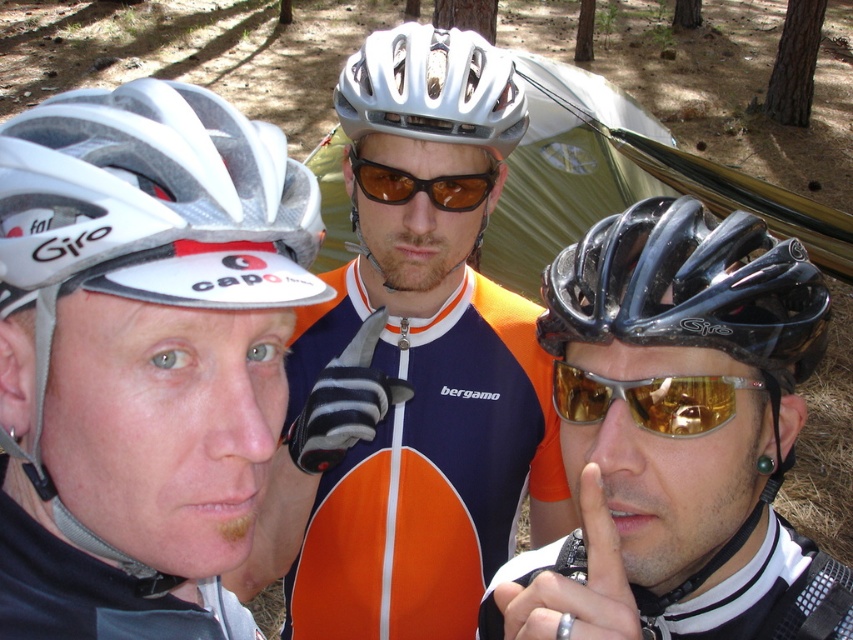
You are standing in the forest scene and want to move from the point closer to you to the point further away. Which path would you take between the two points, point (236,275) and point (553,332)?

You should take the path from point (236,275) to point (553,332) because point (236,275) is closer to the viewer and you need to move to the farther point.

You are a photographer setting up a shot of the matte white helmet at center and the metallic ring at center. You need to frame both objects so that they appear balanced in the composition. Considering their sizes, which object should you place closer to the camera to achieve this balance?

The matte white helmet at center is wider than the metallic ring at center. To balance their sizes in the composition, you should place the metallic ring at center closer to the camera since it is narrower and needs to appear larger in the frame to match the size of the matte white helmet at center.

You are a photographer positioned at the camera. You want to take a photo that includes both the point at (515, 404) and the point at (573, 634). Which point should you focus on first to ensure both are in focus?

You should focus on the point at (515, 404) first because it is closer to the camera than the point at (573, 634). By focusing on the closer point, the farther point will also be within the depth of field and in focus.